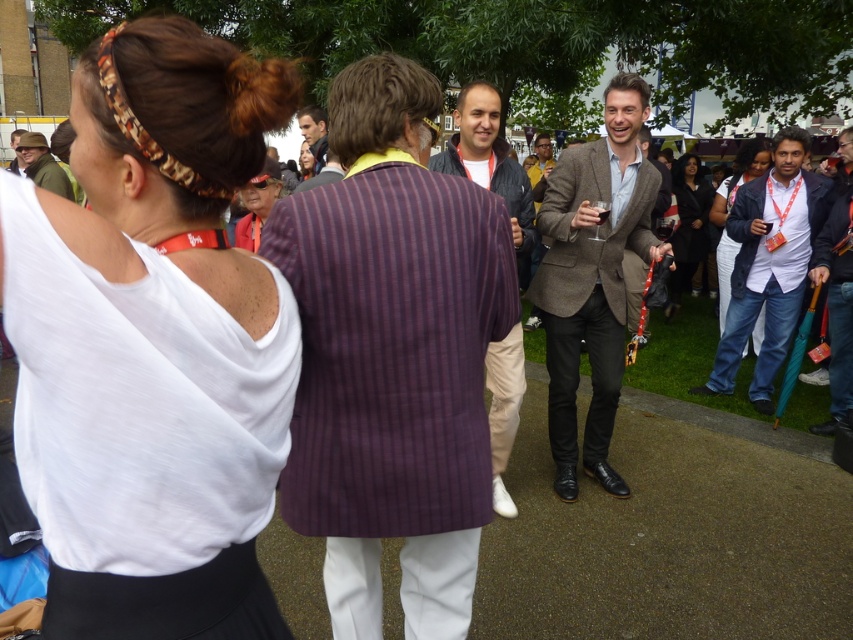
You are standing at the point with coordinates point (403, 161) and want to move towards the point with coordinates point (730, 232). Which direction should you move to get closer to the second point?

To move from point (403, 161) towards point (730, 232), you should move downward and to the right because the second point is located below and to the right of the first point.